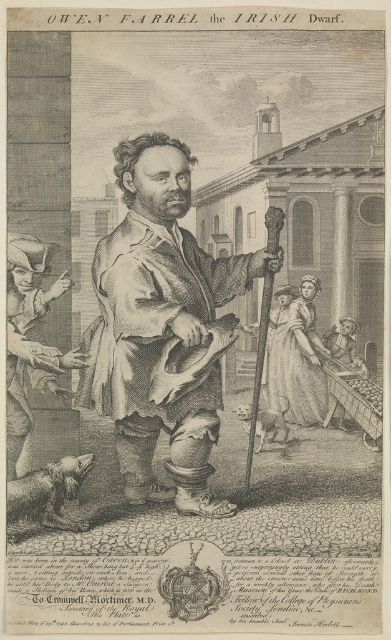
Based on the scene description, which object is positioned higher up in the image between the matte brown coat at center and the silky white gown at center?

The matte brown coat at center is taller than the silky white gown at center, so it is positioned higher up in the image.

Based on the scene described, which object is wider between the smooth skin figure at lower left and the silky white gown at center?

The smooth skin figure at lower left is wider than the silky white gown at center.